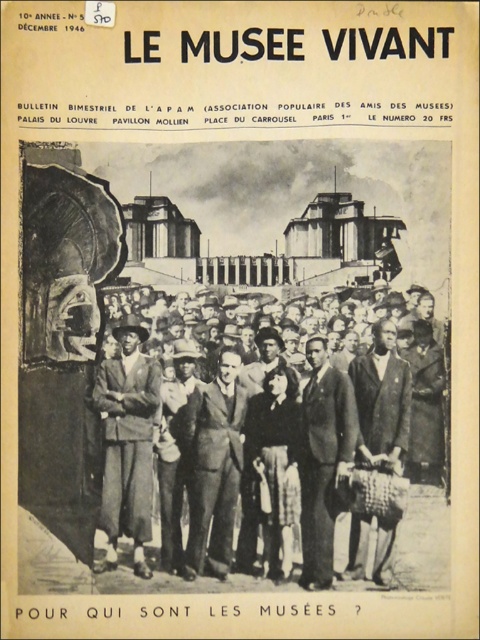
You are an event organizer planning to set up a photo booth for attendees of the museum gathering depicted in the image. The photo booth requires a 10 meter wide space. Given the distance between the smooth black suit at center and the dark brown suit at center, is this space sufficient for the photo booth? Please explain your reasoning.

The smooth black suit at center and the dark brown suit at center are 9.31 meters apart. Since the required space for the photo booth is 10 meters, the distance between them is insufficient. The photo booth would need a slightly wider space than currently available.

Based on the scene described in the bulletin cover, there are two individuals wearing a smooth black suit at center and a dark brown suit at center. Which of these two suits is wider?

The smooth black suit at center might be wider than dark brown suit at center according to the description provided.